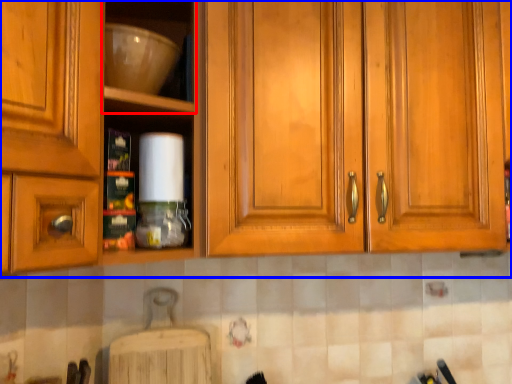
Question: Which object appears farthest to the camera in this image, shelf (highlighted by a red box) or cabinetry (highlighted by a blue box)?

Choices:
 (A) shelf
 (B) cabinetry

Answer: (B)